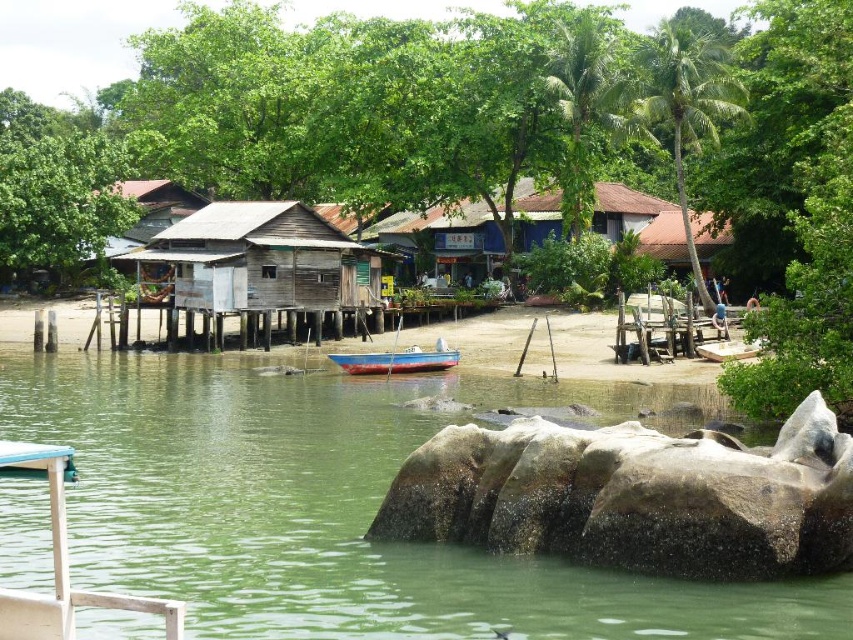
Does green smooth water at center have a lesser height compared to gray rough rock at lower center?

No, green smooth water at center is not shorter than gray rough rock at lower center.

Is point (265, 419) farther from camera compared to point (851, 474)?

Yes.

What do you see at coordinates (341, 504) in the screenshot? The width and height of the screenshot is (853, 640). I see `green smooth water at center` at bounding box center [341, 504].

The width and height of the screenshot is (853, 640). Identify the location of green smooth water at center. (341, 504).

Who is higher up, green leafy tree at center or green smooth water at center?

green leafy tree at center is above.

Does point (235, 6) come closer to viewer compared to point (138, 362)?

No, it is not.

Where is `green leafy tree at center`? The height and width of the screenshot is (640, 853). green leafy tree at center is located at coordinates (526, 138).

In the scene shown: Is gray rough rock at lower center to the right of brown wooden hut at upper left from the viewer's perspective?

Yes, gray rough rock at lower center is to the right of brown wooden hut at upper left.

Who is more forward, (827, 486) or (119, 268)?

Point (827, 486)

Measure the distance between point (698, 541) and camera.

Point (698, 541) is 23.00 meters from camera.

Find the location of a particular element. gray rough rock at lower center is located at coordinates (635, 497).